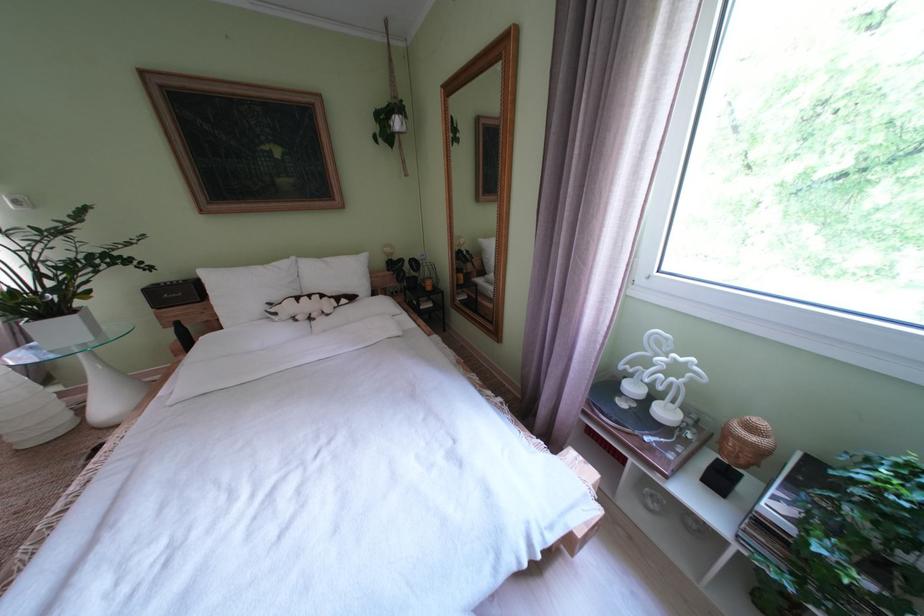
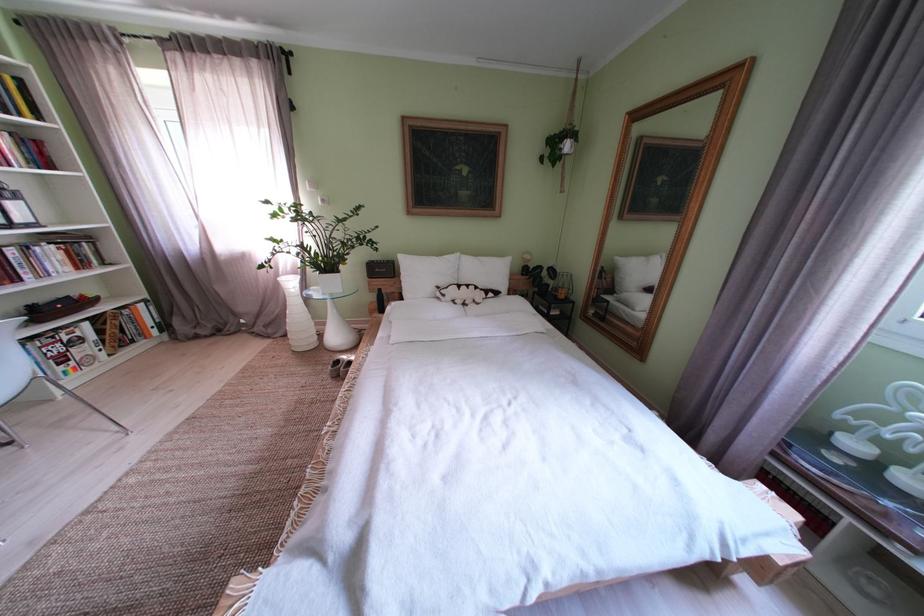
In a continuous first-person perspective shot, in which direction is the camera moving?

The cameraman walked toward left, backward.